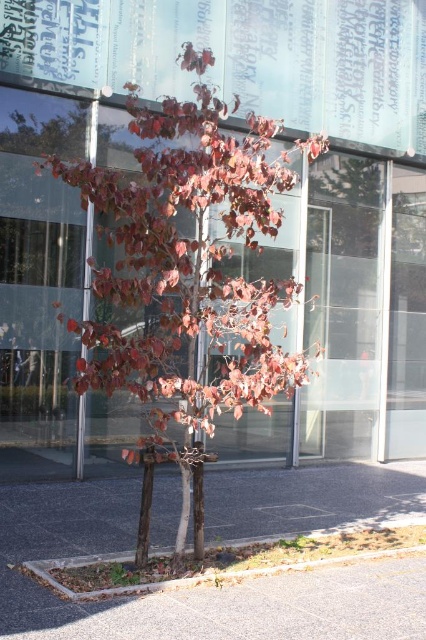
Consider the image. Can you confirm if brown asphalt at lower center is smaller than gray concrete curb at lower center?

Correct, brown asphalt at lower center occupies less space than gray concrete curb at lower center.

Does brown asphalt at lower center have a lesser height compared to gray concrete curb at lower center?

Correct, brown asphalt at lower center is not as tall as gray concrete curb at lower center.

Does point (158, 604) come behind point (54, 586)?

No, (158, 604) is in front of (54, 586).

At what (x,y) coordinates should I click in order to perform the action: click on brown asphalt at lower center. Please return your answer as a coordinate pair (x, y). Looking at the image, I should click on (181, 592).

Measure the distance between reddish-brown bark tree at center and camera.

reddish-brown bark tree at center and camera are 4.27 meters apart from each other.

In order to click on reddish-brown bark tree at center in this screenshot , I will do `click(186, 268)`.

Is reddish-brown bark tree at center closer to the viewer compared to gray concrete curb at lower center?

No, reddish-brown bark tree at center is further to the viewer.

Which is more to the right, reddish-brown bark tree at center or gray concrete curb at lower center?

From the viewer's perspective, gray concrete curb at lower center appears more on the right side.

At what (x,y) coordinates should I click in order to perform the action: click on reddish-brown bark tree at center. Please return your answer as a coordinate pair (x, y). The image size is (426, 640). Looking at the image, I should click on (186, 268).